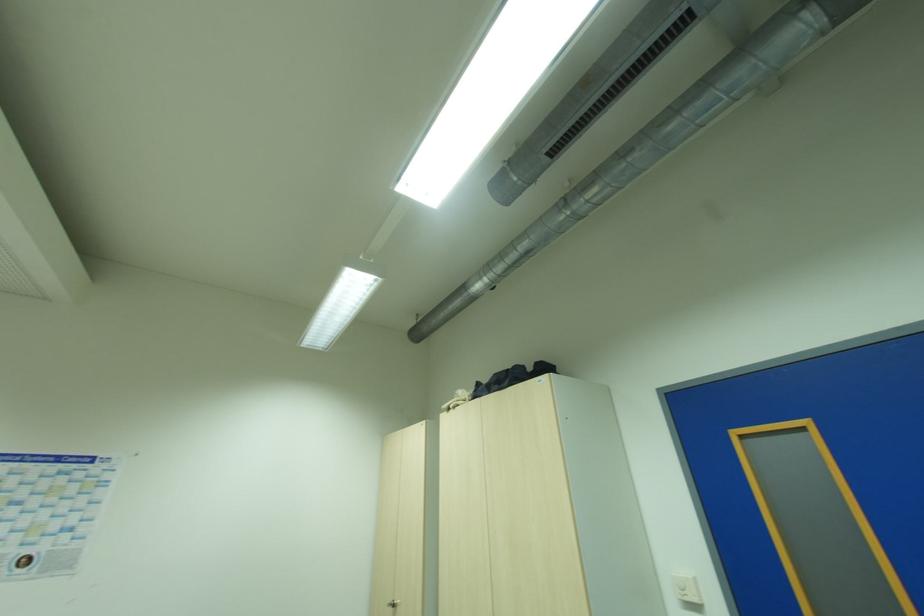
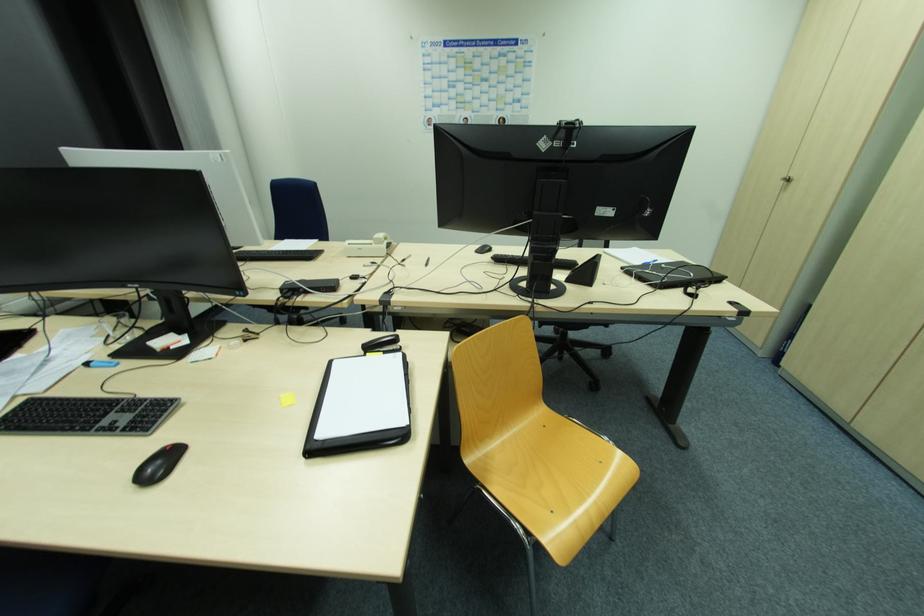
Looking at this image, the first image is from the beginning of the video and the second image is from the end. How did the camera likely rotate when shooting the video?

The camera rotated toward left-down.